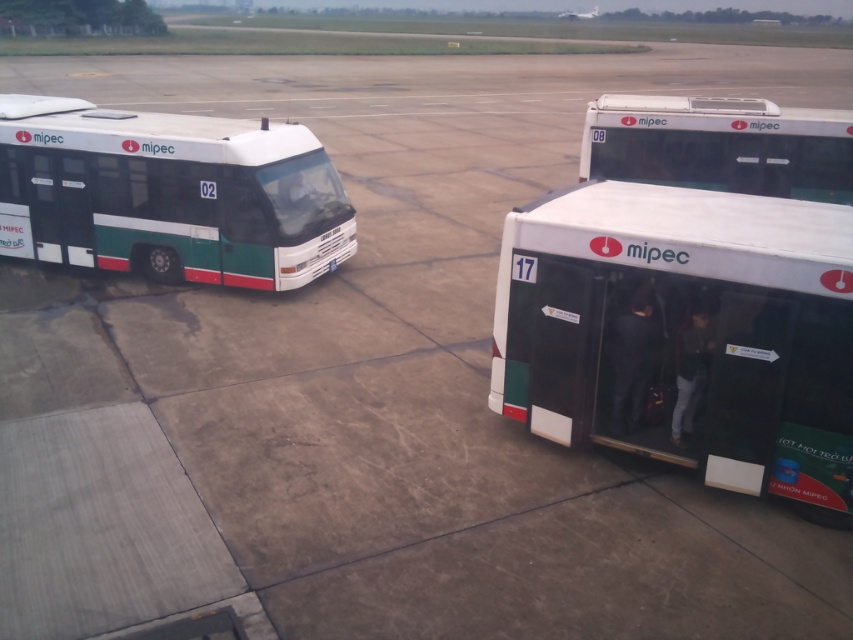
Does point (575, 378) come farther from viewer compared to point (231, 236)?

That is False.

What do you see at coordinates (683, 333) in the screenshot? The width and height of the screenshot is (853, 640). I see `white matte bus at right` at bounding box center [683, 333].

The image size is (853, 640). Describe the element at coordinates (683, 333) in the screenshot. I see `white matte bus at right` at that location.

Where is `white matte bus at right`? The height and width of the screenshot is (640, 853). white matte bus at right is located at coordinates (683, 333).

Describe the element at coordinates (169, 195) in the screenshot. I see `green matte bus at left` at that location.

Who is positioned more to the left, green matte bus at left or white matte bus at upper right?

Positioned to the left is green matte bus at left.

Image resolution: width=853 pixels, height=640 pixels. I want to click on green matte bus at left, so pyautogui.click(x=169, y=195).

This screenshot has height=640, width=853. I want to click on green matte bus at left, so click(x=169, y=195).

Who is more distant from viewer, [729,465] or [686,182]?

Positioned behind is point [686,182].

What are the coordinates of `white matte bus at right` in the screenshot? It's located at (683, 333).